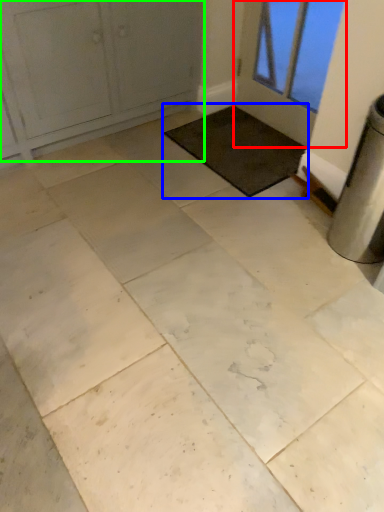
Question: Considering the real-world distances, which object is farthest from door (highlighted by a red box)? mat (highlighted by a blue box) or door (highlighted by a green box)?

Choices:
 (A) mat
 (B) door

Answer: (B)